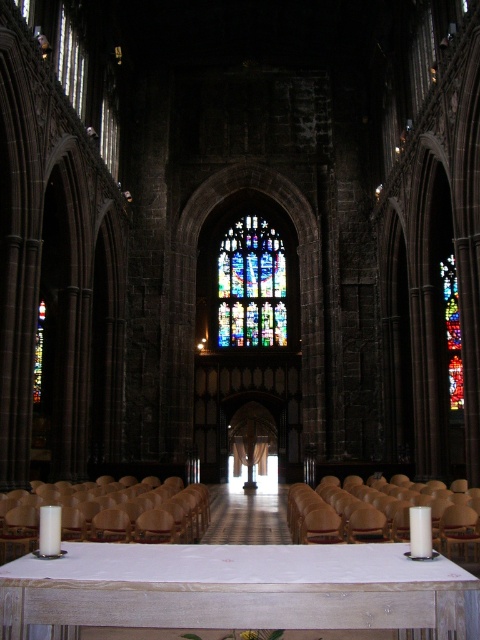
Question: Estimate the real-world distances between objects in this image. Which object is closer to the multicolored stained glass at right?

Choices:
 (A) brown leather chair at lower center
 (B) white wax candle at lower left

Answer: (A)

Question: Considering the relative positions of white wood table at lower center and stained glass at center in the image provided, where is white wood table at lower center located with respect to stained glass at center?

Choices:
 (A) left
 (B) right

Answer: (A)

Question: Which of the following is the closest to the observer?

Choices:
 (A) (451, 348)
 (B) (412, 547)

Answer: (B)

Question: Can you confirm if white wood table at lower center is positioned below brown leather chair at lower center?

Choices:
 (A) no
 (B) yes

Answer: (A)

Question: Does white wood table at lower center have a smaller size compared to white matte candle at center?

Choices:
 (A) yes
 (B) no

Answer: (B)

Question: Based on their relative distances, which object is nearer to the white matte candle at center?

Choices:
 (A) white wood table at lower center
 (B) stained glass at center
 (C) brown wood chair at lower center
 (D) multicolored stained glass at right

Answer: (A)